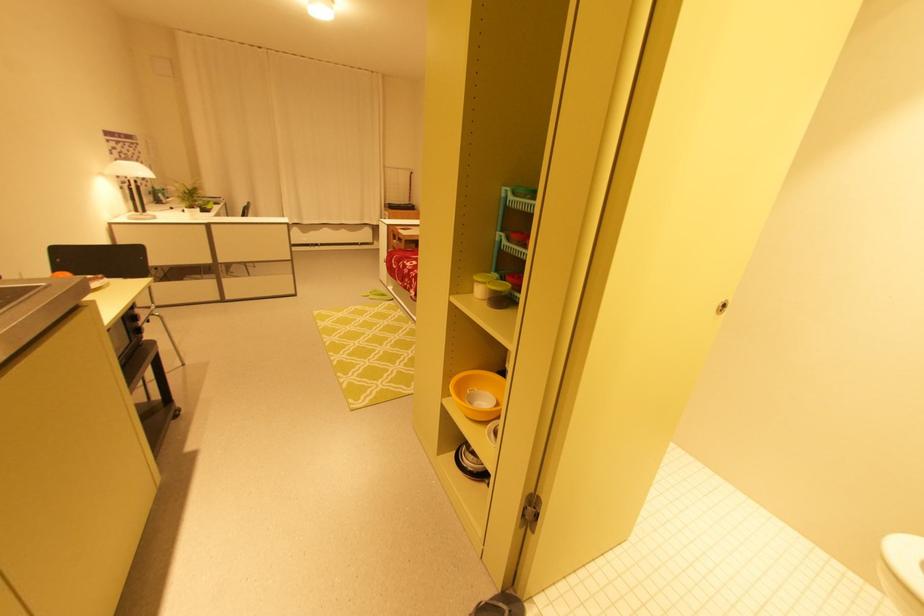
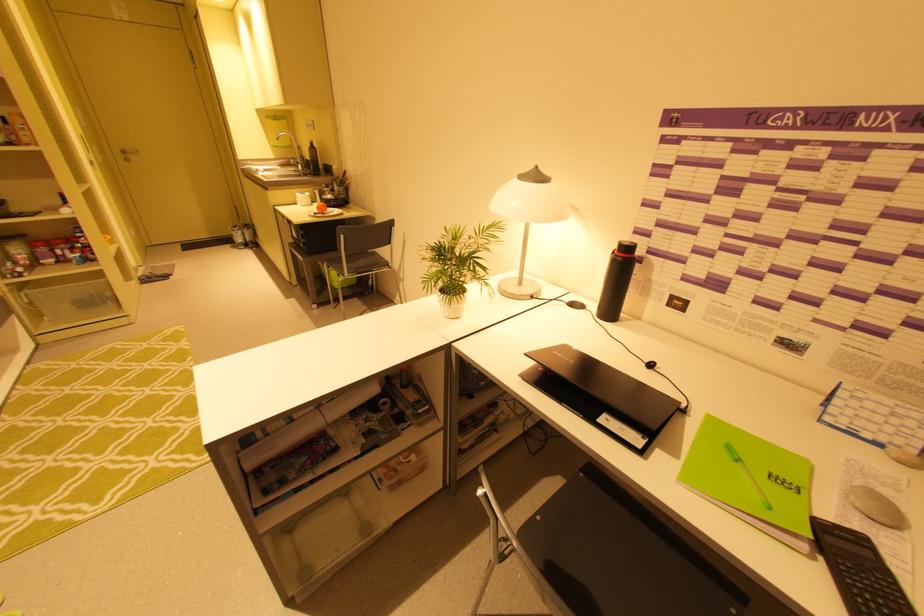
Locate, in the second image, the point that corresponds to [214,209] in the first image.

(596, 419)